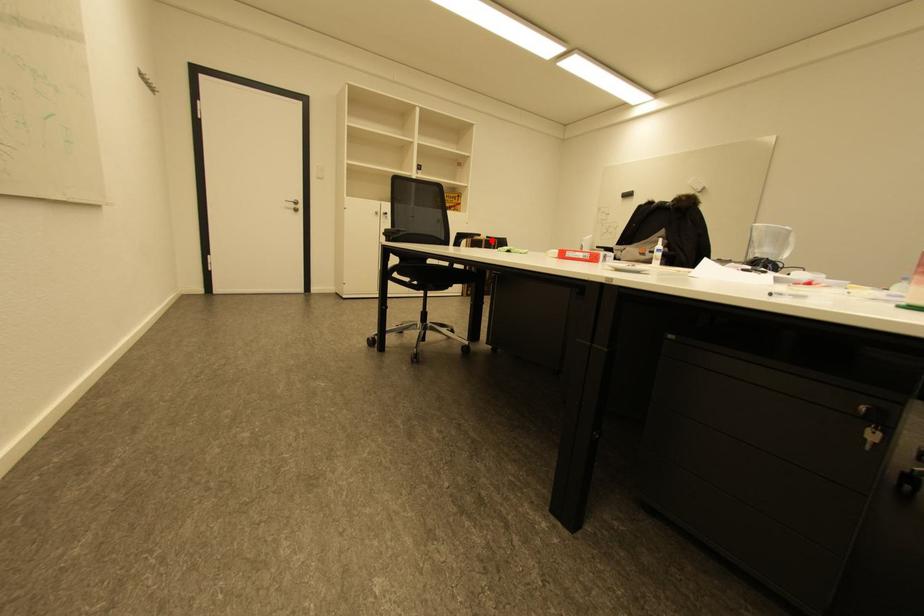
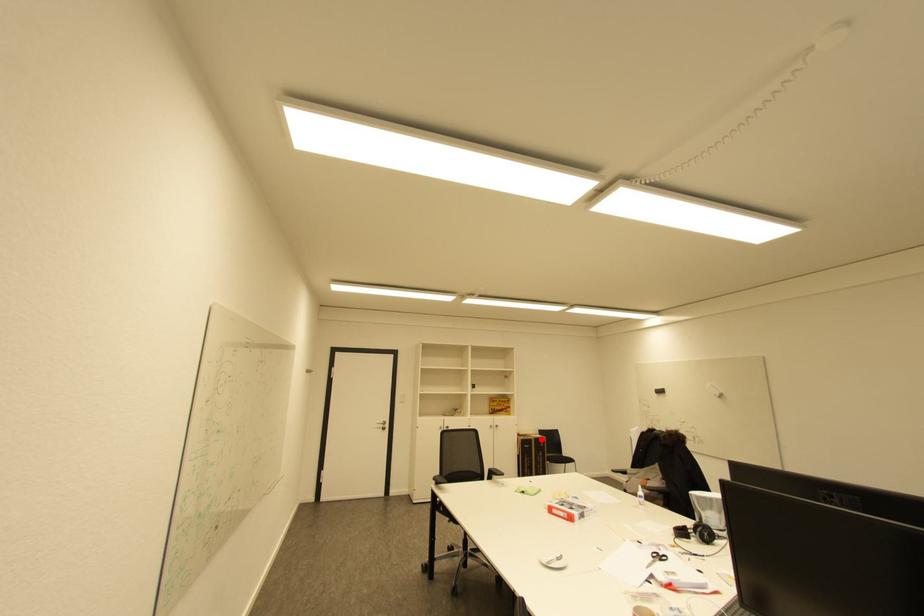
I am providing you with two images of the same scene from different viewpoints. A red point is marked on the first image and another point is marked on the second image. Are the points marked in image1 and image2 representing the same 3D position?

Yes